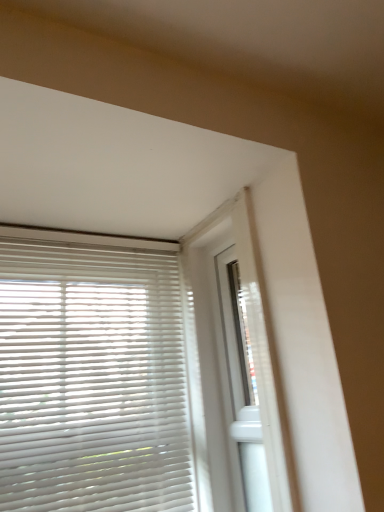
Describe the element at coordinates (92, 374) in the screenshot. I see `white matte blinds at left` at that location.

Locate an element on the screen. white matte blinds at left is located at coordinates (92, 374).

You are a GUI agent. You are given a task and a screenshot of the screen. Output one action in this format:
    pyautogui.click(x=<x>, y=<y>)
    Task: Click on the white matte blinds at left
    
    Given the screenshot: What is the action you would take?
    pyautogui.click(x=92, y=374)